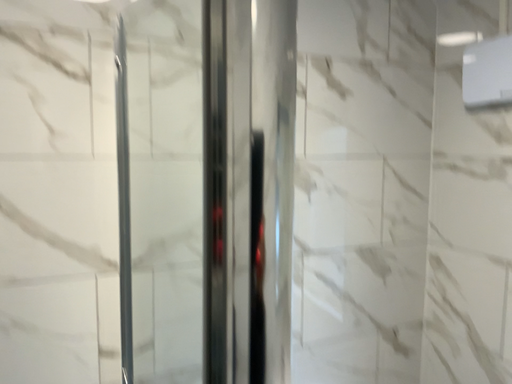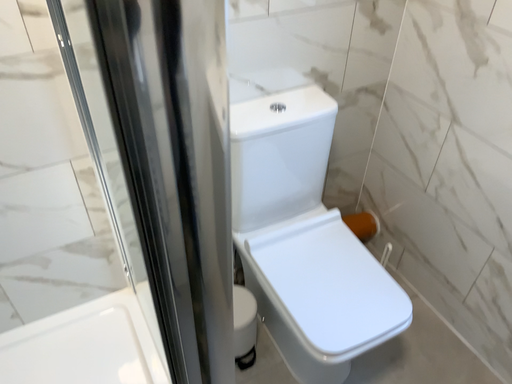
Question: Which way did the camera rotate in the video?

Choices:
 (A) rotated upward
 (B) rotated downward

Answer: (B)